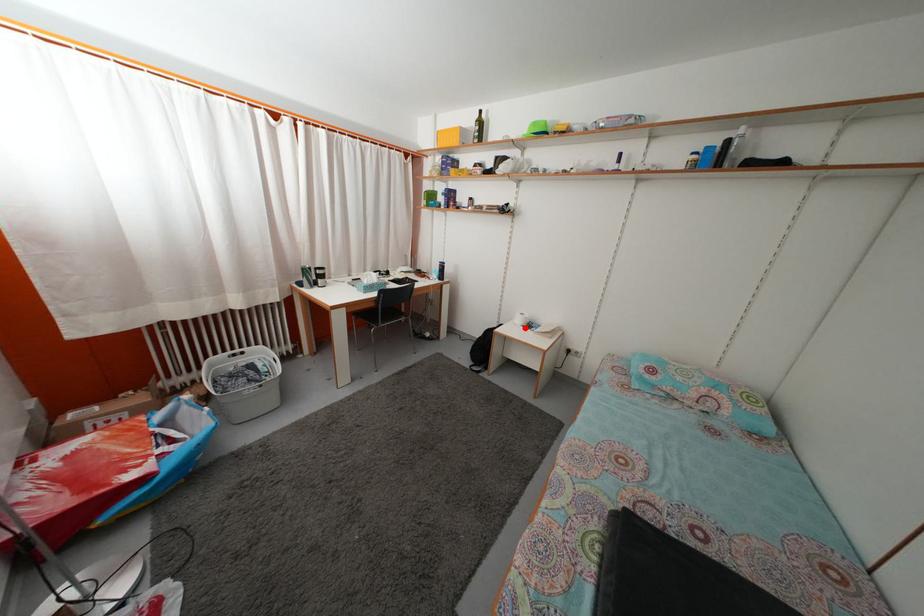
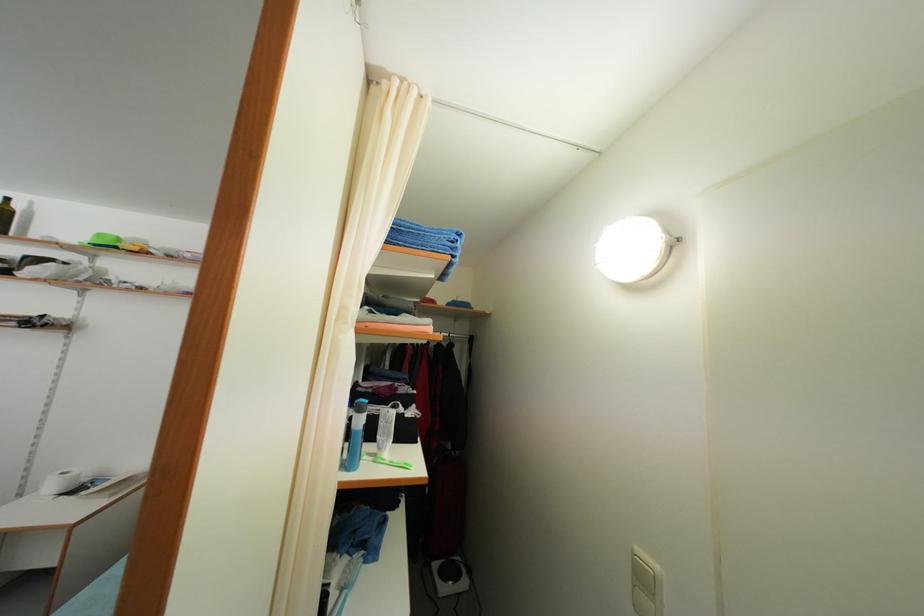
Question: I am providing you with two images of the same scene from different viewpoints. A red point is shown in image1. For the corresponding object point in image2, is it positioned nearer or farther from the camera?

Choices:
 (A) Nearer
 (B) Farther

Answer: (A)